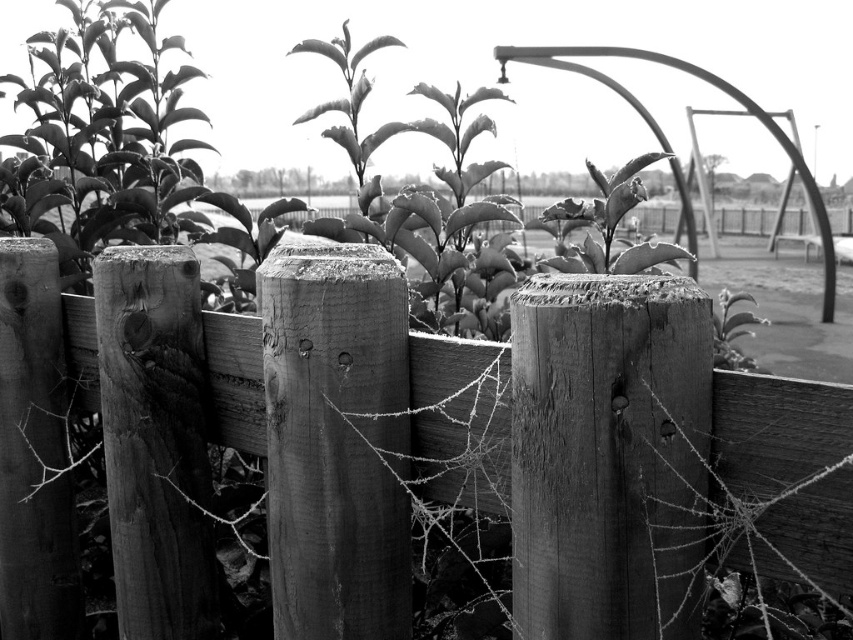
Question: Which point appears farthest from the camera in this image?

Choices:
 (A) (625, 164)
 (B) (660, 292)

Answer: (A)

Question: Among these points, which one is nearest to the camera?

Choices:
 (A) (227, 432)
 (B) (624, 177)

Answer: (A)

Question: Can you confirm if wooden fence at center is positioned to the left of smooth green leaf at center?

Choices:
 (A) yes
 (B) no

Answer: (A)

Question: In this image, where is wooden fence at center located relative to smooth green leaf at center?

Choices:
 (A) above
 (B) below

Answer: (B)

Question: Is wooden fence at center positioned behind smooth green leaf at center?

Choices:
 (A) yes
 (B) no

Answer: (B)